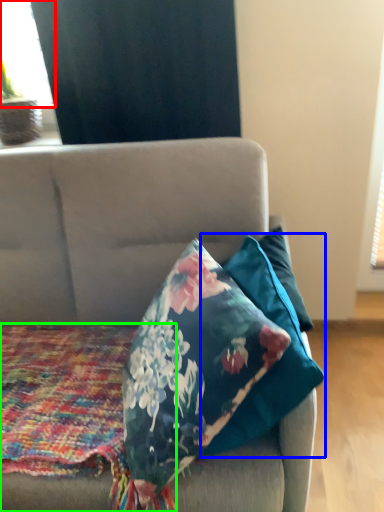
Question: Which object is positioned closest to window screen (highlighted by a red box)? Select from pillow (highlighted by a blue box) and blanket (highlighted by a green box).

Choices:
 (A) pillow
 (B) blanket

Answer: (B)